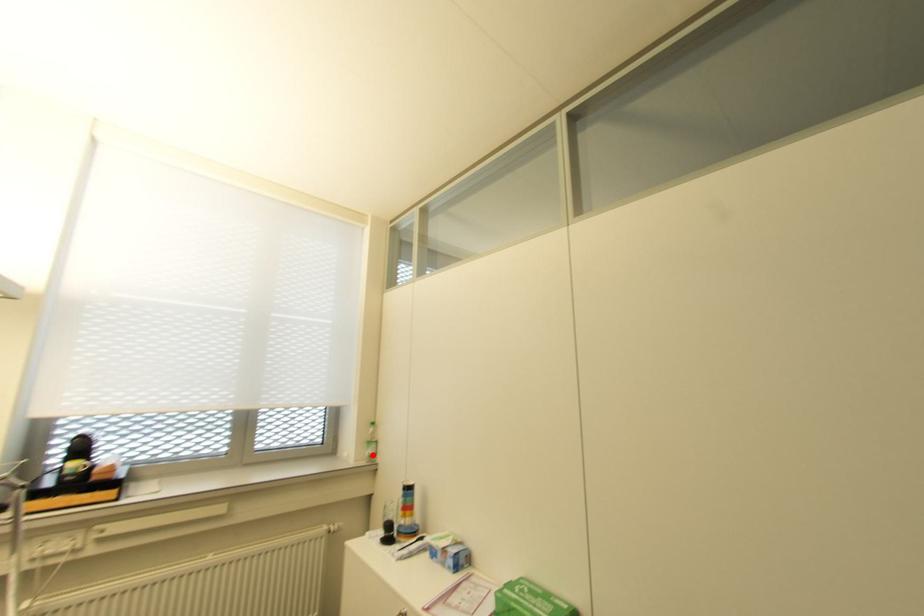
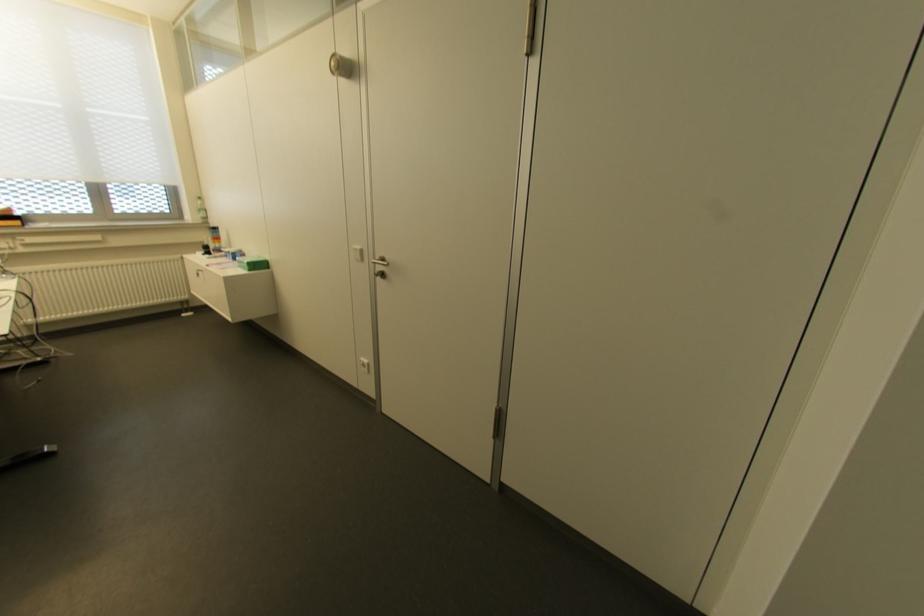
Find the pixel in the second image that matches the highlighted location in the first image.

(204, 217)